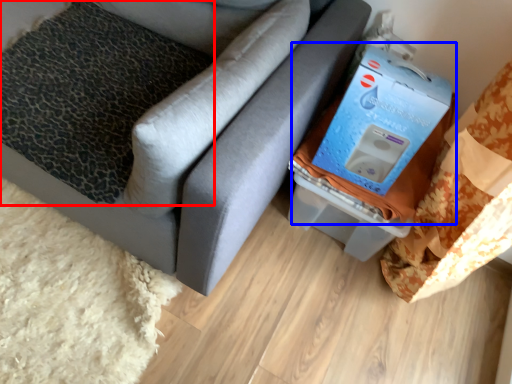
Question: Which point is closer to the camera, pillow (highlighted by a red box) or storage box (highlighted by a blue box)?

Choices:
 (A) pillow
 (B) storage box

Answer: (B)